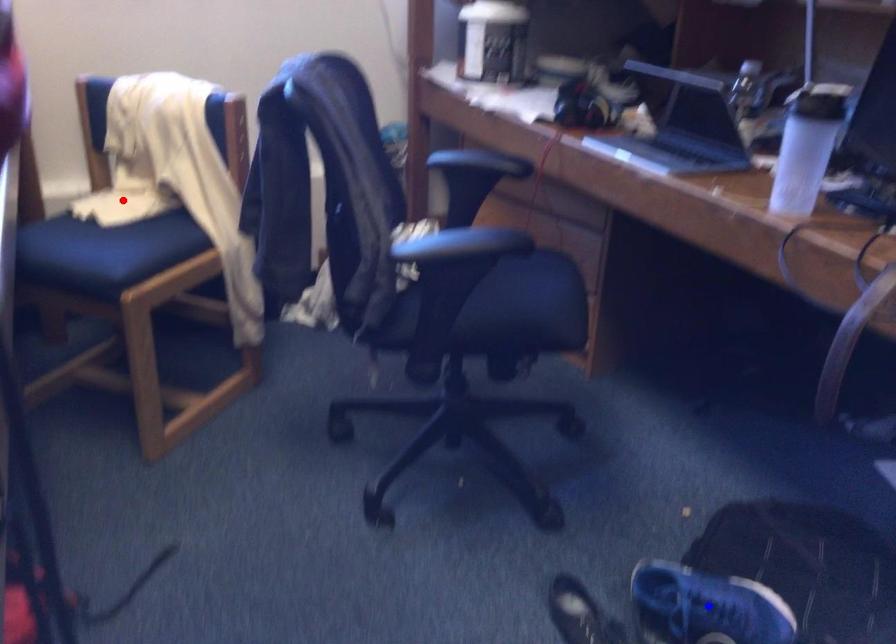
Question: In the image, two points are highlighted. Which point is nearer to the camera? Reply with the corresponding letter.

Choices:
 (A) blue point
 (B) red point

Answer: (A)